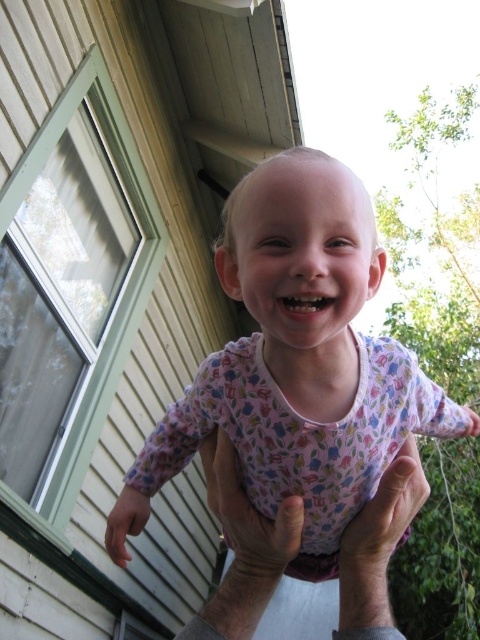
Question: Is pink floral pajamas at center positioned at the back of skinny white hands at lower center?

Choices:
 (A) no
 (B) yes

Answer: (A)

Question: Which point is closer to the camera?

Choices:
 (A) (243, 225)
 (B) (245, 570)

Answer: (A)

Question: Among these objects, which one is farthest from the camera?

Choices:
 (A) pink floral pajamas at center
 (B) skinny white hands at lower center

Answer: (B)

Question: Which point is farther to the camera?

Choices:
 (A) skinny white hands at lower center
 (B) pink floral pajamas at center

Answer: (A)

Question: Can you confirm if pink floral pajamas at center is positioned to the left of skinny white hands at lower center?

Choices:
 (A) yes
 (B) no

Answer: (B)

Question: Is pink floral pajamas at center thinner than skinny white hands at lower center?

Choices:
 (A) yes
 (B) no

Answer: (B)